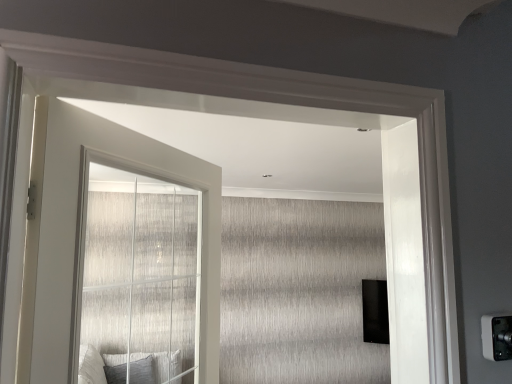
Question: Should I look upward or downward to see white glossy door at upper center?

Choices:
 (A) up
 (B) down

Answer: (B)